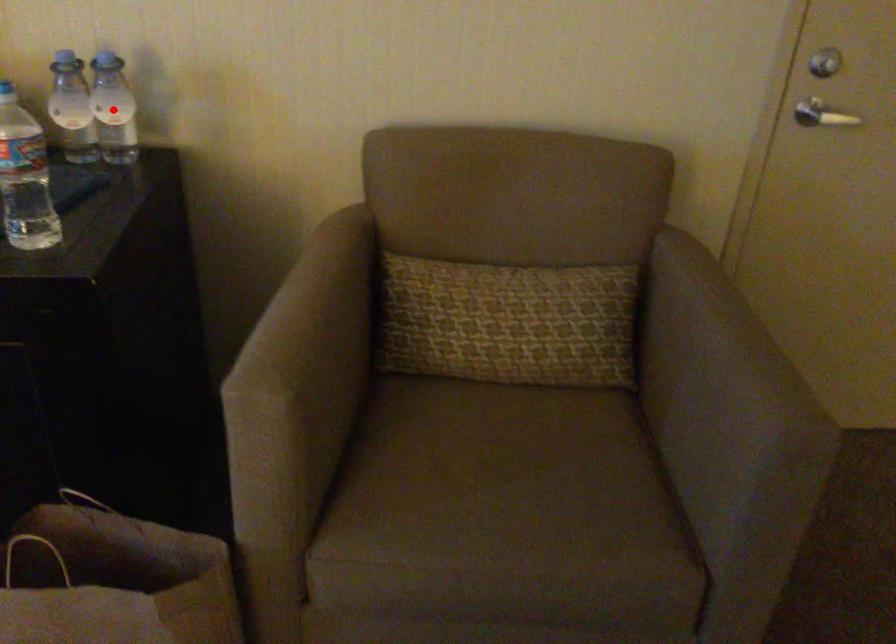
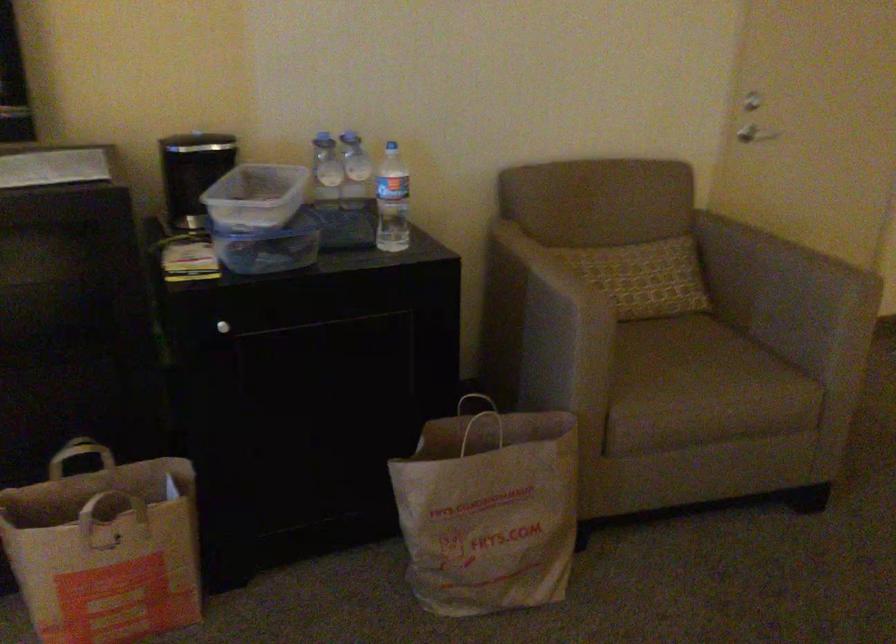
The point at the highlighted location is marked in the first image. Where is the corresponding point in the second image?

(355, 171)